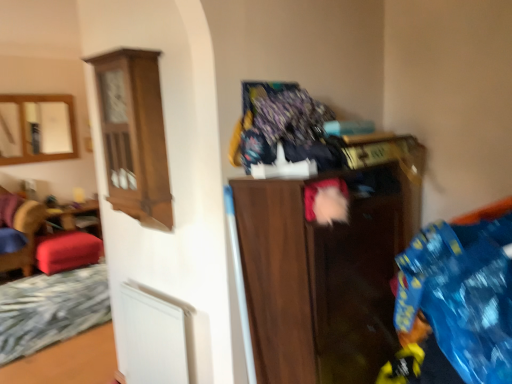
Question: Does velvet red stool at left have a larger size compared to matte wood mirror at upper left?

Choices:
 (A) yes
 (B) no

Answer: (A)

Question: Is velvet red stool at left placed right next to matte wood mirror at upper left?

Choices:
 (A) yes
 (B) no

Answer: (B)

Question: Is velvet red stool at left further to the viewer compared to matte wood mirror at upper left?

Choices:
 (A) no
 (B) yes

Answer: (A)

Question: From a real-world perspective, is velvet red stool at left physically below matte wood mirror at upper left?

Choices:
 (A) no
 (B) yes

Answer: (B)

Question: Is velvet red stool at left to the right of matte wood mirror at upper left from the viewer's perspective?

Choices:
 (A) yes
 (B) no

Answer: (A)

Question: Is velvet red stool at left shorter than matte wood mirror at upper left?

Choices:
 (A) yes
 (B) no

Answer: (A)

Question: Does velvet red stool at left lie behind fluffy multicolored blanket at upper center?

Choices:
 (A) yes
 (B) no

Answer: (A)

Question: Is velvet red stool at left to the right of fluffy multicolored blanket at upper center from the viewer's perspective?

Choices:
 (A) no
 (B) yes

Answer: (A)

Question: From a real-world perspective, is velvet red stool at left on fluffy multicolored blanket at upper center?

Choices:
 (A) no
 (B) yes

Answer: (A)

Question: Is velvet red stool at left thinner than fluffy multicolored blanket at upper center?

Choices:
 (A) yes
 (B) no

Answer: (B)

Question: Does velvet red stool at left have a lesser height compared to fluffy multicolored blanket at upper center?

Choices:
 (A) yes
 (B) no

Answer: (B)

Question: Is velvet red stool at left to the left of fluffy multicolored blanket at upper center from the viewer's perspective?

Choices:
 (A) no
 (B) yes

Answer: (B)

Question: Is matte wood mirror at upper left not inside velvet red stool at left?

Choices:
 (A) yes
 (B) no

Answer: (A)